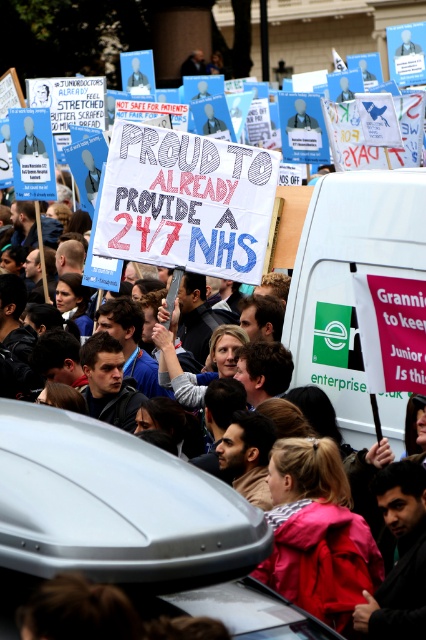
Question: Does white fabric crowd at center appear on the right side of white matte van at center-right?

Choices:
 (A) no
 (B) yes

Answer: (A)

Question: Where is white fabric crowd at center located in relation to white matte van at center-right in the image?

Choices:
 (A) above
 (B) below

Answer: (B)

Question: Which of the following is the closest to the observer?

Choices:
 (A) white fabric crowd at center
 (B) white matte van at center-right

Answer: (A)

Question: Is white fabric crowd at center above white matte van at center-right?

Choices:
 (A) no
 (B) yes

Answer: (A)

Question: Among these points, which one is nearest to the camera?

Choices:
 (A) (316, 276)
 (B) (313, 305)

Answer: (A)